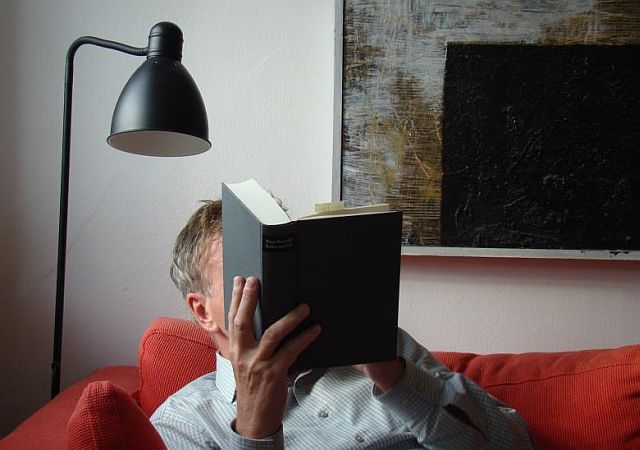
At what (x,y) coordinates should I click in order to perform the action: click on lamp. Please return your answer as a coordinate pair (x, y). This screenshot has width=640, height=450. Looking at the image, I should click on (160, 82).